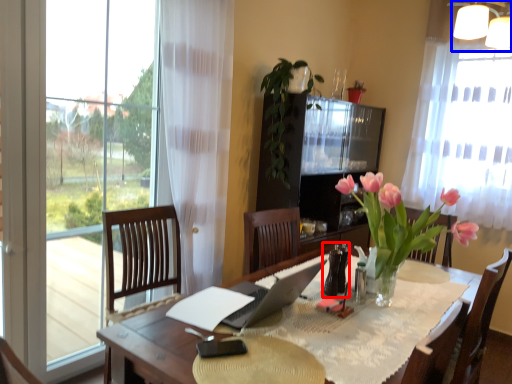
Question: Which object is closer to the camera taking this photo, bottle (highlighted by a red box) or lamp (highlighted by a blue box)?

Choices:
 (A) bottle
 (B) lamp

Answer: (A)